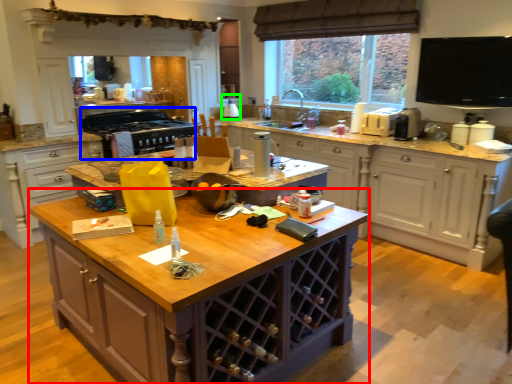
Question: Estimate the real-world distances between objects in this image. Which object is closer to cabinetry (highlighted by a red box), appliance (highlighted by a blue box) or appliance (highlighted by a green box)?

Choices:
 (A) appliance
 (B) appliance

Answer: (A)